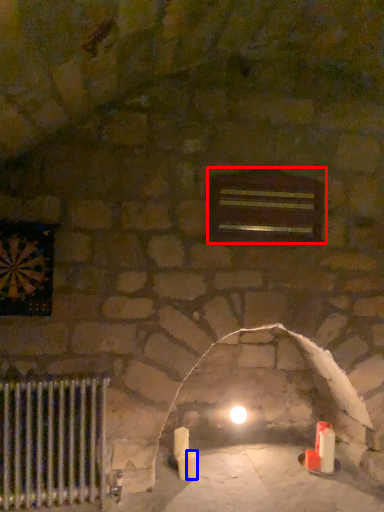
Question: Which point is closer to the camera, window (highlighted by a red box) or candle (highlighted by a blue box)?

Choices:
 (A) window
 (B) candle

Answer: (A)